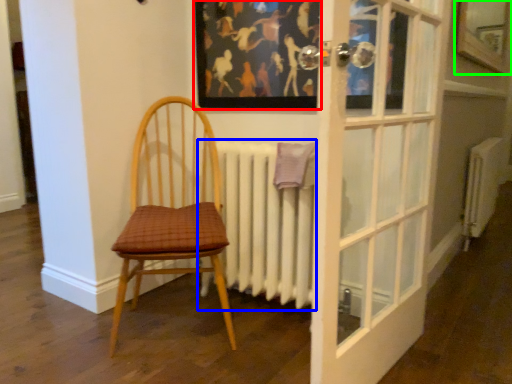
Question: Which object is positioned farthest from picture frame (highlighted by a red box)? Select from radiator (highlighted by a blue box) and window (highlighted by a green box).

Choices:
 (A) radiator
 (B) window

Answer: (B)